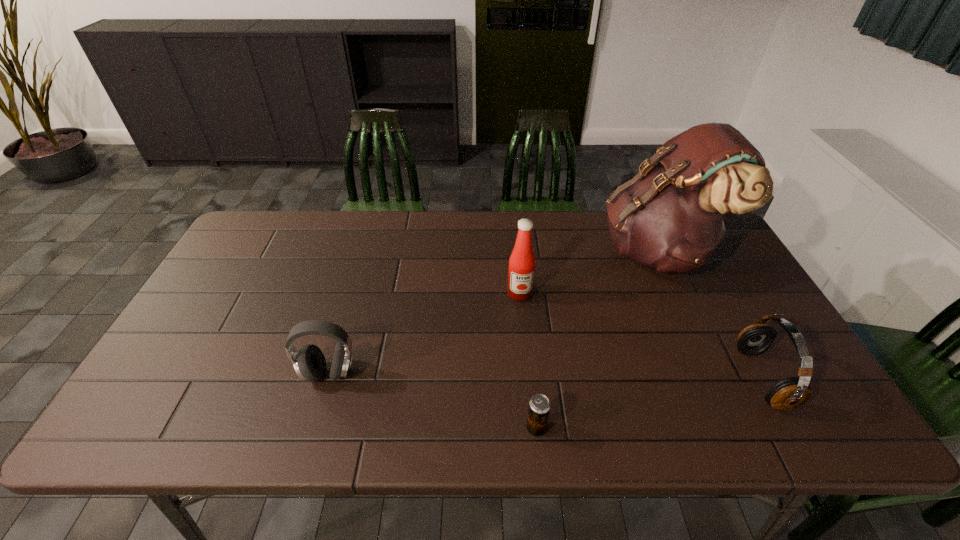
You are a GUI agent. You are given a task and a screenshot of the screen. Output one action in this format:
    pyautogui.click(x=<x>, y=<y>)
    Task: Click on the free space located 0.100m on the ear cups of the leftmost object
    The image size is (960, 540).
    Given the screenshot: What is the action you would take?
    pyautogui.click(x=313, y=429)

The height and width of the screenshot is (540, 960). I want to click on vacant space situated 0.180m on the ear cups of the right headset, so click(x=669, y=377).

I want to click on blank area located on the ear cups of the right headset, so [661, 377].

This screenshot has width=960, height=540. What are the coordinates of `free spot located on the ear cups of the right headset` in the screenshot? It's located at (619, 377).

Locate an element on the screen. This screenshot has height=540, width=960. vacant area located 0.070m on the back of the nearest object is located at coordinates (533, 392).

Where is `object located in the far edge section of the desktop`? object located in the far edge section of the desktop is located at coordinates coord(671,216).

Where is `headset at the near edge`? headset at the near edge is located at coordinates (788, 393).

At what (x,y) coordinates should I click in order to perform the action: click on beer can that is at the near edge. Please return your answer as a coordinate pair (x, y). The height and width of the screenshot is (540, 960). Looking at the image, I should click on point(539,406).

Identify the location of satchel present at the right edge. (671, 216).

Image resolution: width=960 pixels, height=540 pixels. What are the coordinates of `headset that is at the right edge` in the screenshot? It's located at click(788, 393).